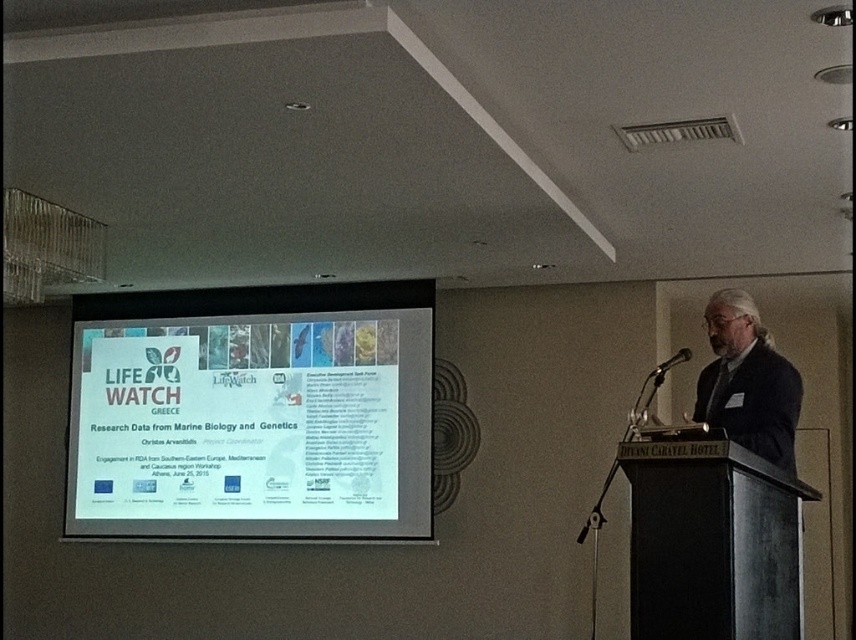
Question: Observing the image, what is the correct spatial positioning of black polished wood podium at center in reference to black plastic microphone at center?

Choices:
 (A) above
 (B) below

Answer: (B)

Question: Can you confirm if white paper at center is smaller than black plastic microphone at center?

Choices:
 (A) yes
 (B) no

Answer: (B)

Question: Which point is closer to the camera?

Choices:
 (A) black plastic microphone at center
 (B) gray hair at center

Answer: (B)

Question: Estimate the real-world distances between objects in this image. Which object is closer to the white paper at center?

Choices:
 (A) gray hair at center
 (B) black polished wood podium at center

Answer: (A)

Question: Can you confirm if white paper at center is wider than black plastic microphone at center?

Choices:
 (A) no
 (B) yes

Answer: (B)

Question: Which of the following is the farthest from the observer?

Choices:
 (A) (693, 444)
 (B) (727, 300)
 (C) (684, 353)
 (D) (413, 364)

Answer: (C)